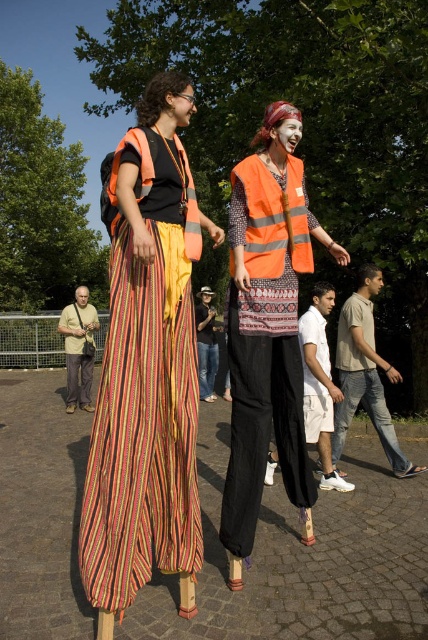
Question: Is white cotton shorts at lower center closer to the viewer compared to matte orange vest at upper center?

Choices:
 (A) no
 (B) yes

Answer: (A)

Question: Among these objects, which one is nearest to the camera?

Choices:
 (A) light beige cotton shirt at lower right
 (B) white cotton shorts at lower center
 (C) beige cotton shirt at lower left
 (D) white matte face at center

Answer: (D)

Question: Which object appears farthest from the camera in this image?

Choices:
 (A) reflective orange safety vest at left
 (B) white matte face at center
 (C) denim jeans at center

Answer: (C)

Question: Which is nearer to the reflective orange safety vest at center?

Choices:
 (A) white matte face at center
 (B) orange reflective vest at center

Answer: (B)

Question: Is striped fabric pants at left positioned before denim jeans at center?

Choices:
 (A) no
 (B) yes

Answer: (B)

Question: Observing the image, what is the correct spatial positioning of white cotton shorts at lower center in reference to matte orange vest at upper center?

Choices:
 (A) below
 (B) above

Answer: (A)